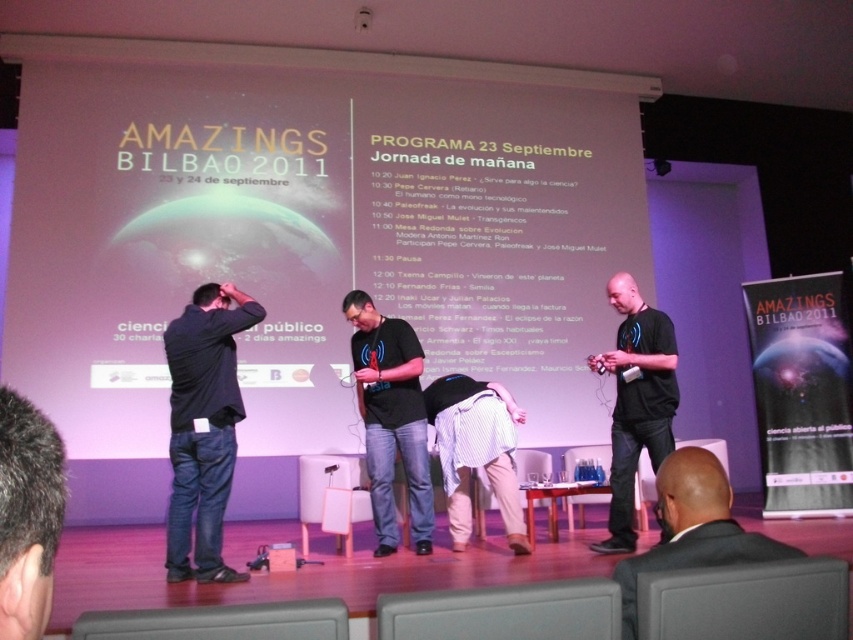
Question: Is dark brown hair at lower left closer to camera compared to black matte shirt at center?

Choices:
 (A) yes
 (B) no

Answer: (A)

Question: Based on their relative distances, which object is nearer to the striped fabric shirt at center?

Choices:
 (A) dark brown hair at lower left
 (B) black cotton shirt at center
 (C) black matte shirt at left

Answer: (C)

Question: Observing the image, what is the correct spatial positioning of black matte shirt at center in reference to striped fabric shirt at center?

Choices:
 (A) below
 (B) above

Answer: (B)

Question: Does black matte shirt at left lie behind black cotton t-shirt at center?

Choices:
 (A) yes
 (B) no

Answer: (B)

Question: Which object is farther from the camera taking this photo?

Choices:
 (A) black cotton t-shirt at center
 (B) black matte shirt at center
 (C) striped fabric shirt at center

Answer: (A)

Question: Among these objects, which one is farthest from the camera?

Choices:
 (A) black matte shirt at center
 (B) matte white screen at upper center
 (C) striped fabric shirt at center
 (D) dark brown hair at lower left

Answer: (B)